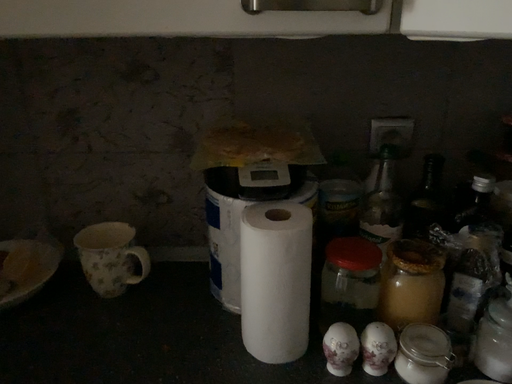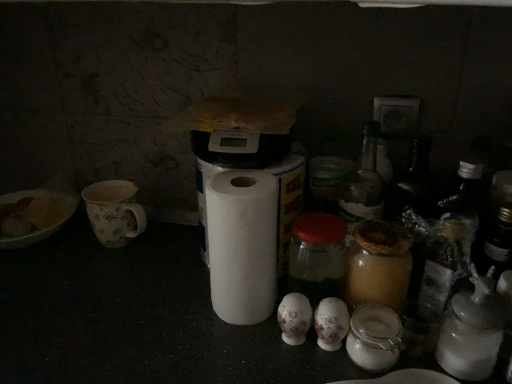
Question: How did the camera likely rotate when shooting the video?

Choices:
 (A) rotated left
 (B) rotated right

Answer: (A)